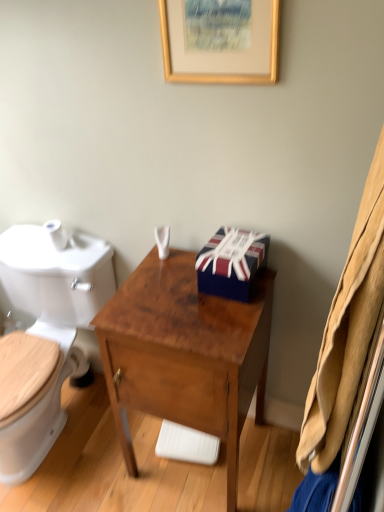
You are a GUI agent. You are given a task and a screenshot of the screen. Output one action in this format:
    pyautogui.click(x=<x>, y=<y>)
    Task: Click on the free space in front of white plastic container at center
    This screenshot has width=384, height=512.
    Given the screenshot: What is the action you would take?
    pyautogui.click(x=160, y=288)